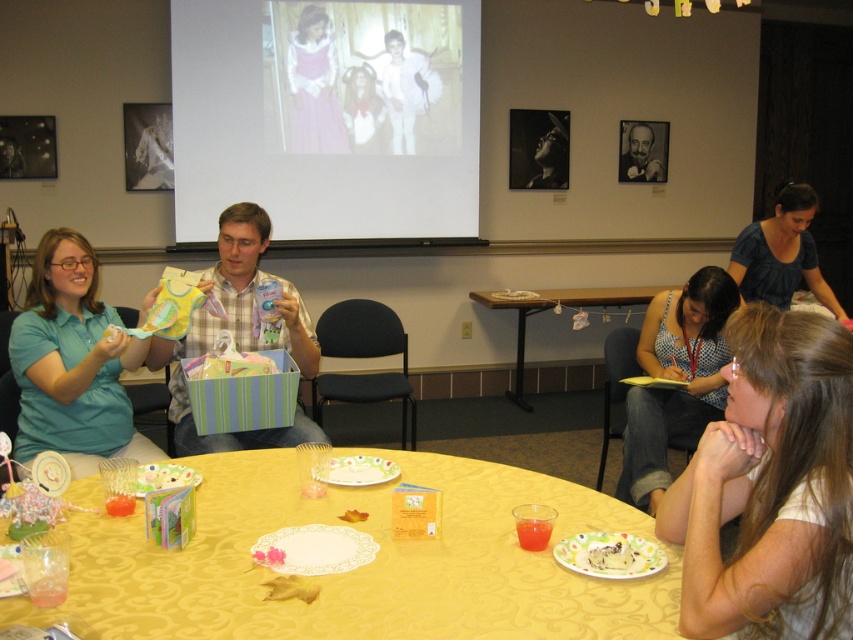
You are standing at the entrance of the room and want to walk directly to the yellow fabric table at center. What is the shortest path you can take without moving any objects?

The shortest path to the yellow fabric table at center would be a straight line towards its 2D location at point (363, 564), assuming no obstacles are present in the room.

From the picture: You are a photographer standing at the back of the room. You want to take a photo of the blue checkered shirt at lower right and the blue cotton shirt at upper right. Is there enough space between them to ensure both are fully visible in the frame?

The distance between the blue checkered shirt at lower right and blue cotton shirt at upper right is 35.02 inches, which is sufficient to capture both shirts in the frame without overlapping, so yes, there is enough space.

In the scene shown: You are a guest at the baby shower and want to retrieve your matte plastic gift bag at upper left without disturbing the blue checkered shirt at lower right. Can you reach it easily?

The matte plastic gift bag at upper left is in front of the blue checkered shirt at lower right, so you can reach it easily without disturbing the shirt.